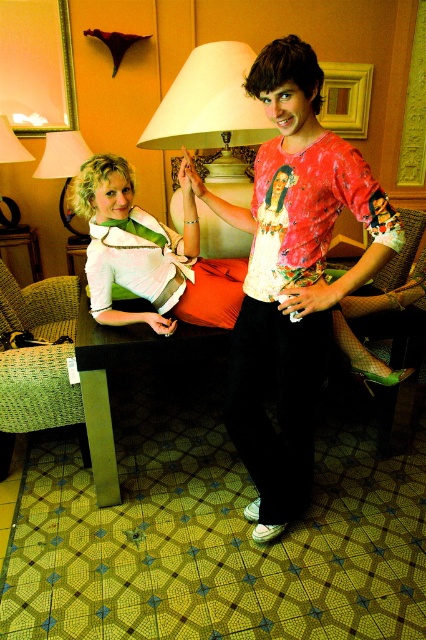
You are planning to place a new decorative item on the table between the green wicker armchair at left and the matte white lampshade at upper center. Considering their sizes, which object should you place closer to the wider one to ensure balance?

The green wicker armchair at left is wider than the matte white lampshade at upper center. To ensure balance, place the decorative item closer to the wider object, which is the green wicker armchair at left.

You are a photographer setting up a shoot in this room. You need to place a small prop between the matte red shirt at center and the matte white lampshade at upper center. Based on their positions, which side of the lampshade should you place it on to keep it aligned with the existing arrangement?

The matte red shirt at center is positioned on the right side of the matte white lampshade at upper center, so placing the prop to the right of the matte white lampshade at upper center would align it with the existing arrangement.

You are standing in the room and want to place a small book on the table. The book needs to be placed between the matte red shirt at center and the matte white lampshade at upper center. Which object should you place the book closer to to ensure it is between them?

The matte red shirt at center is taller than the matte white lampshade at upper center. To place the book between them, position it closer to the matte white lampshade at upper center since the red shirt is taller and the lampshade is lower.